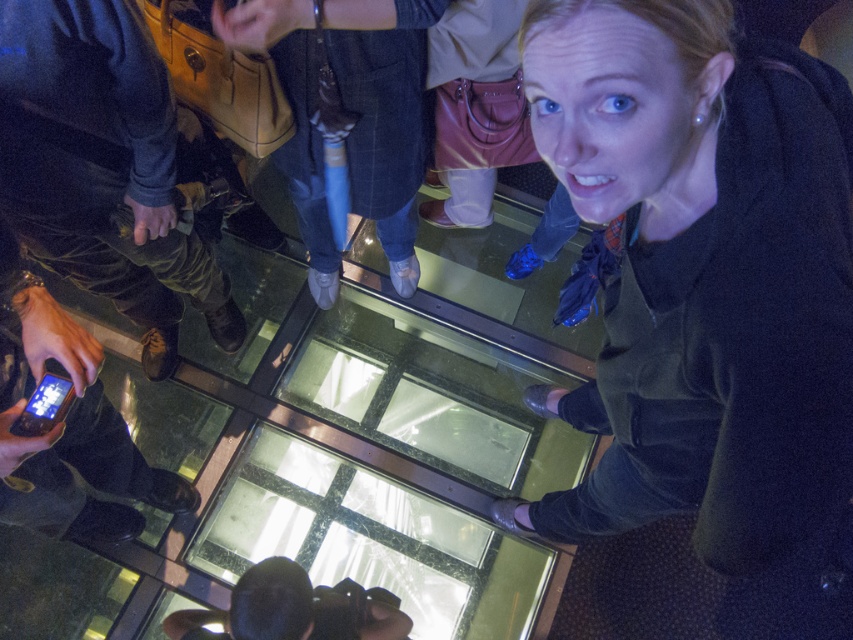
Based on the photo, is velvet black sweater at upper right behind camouflage pants at left?

No, it is in front of camouflage pants at left.

Looking at this image, can you confirm if velvet black sweater at upper right is positioned below camouflage pants at left?

Correct, velvet black sweater at upper right is located below camouflage pants at left.

Is point (709, 492) positioned behind point (149, 232)?

No, (709, 492) is in front of (149, 232).

This screenshot has width=853, height=640. What are the coordinates of `velvet black sweater at upper right` in the screenshot? It's located at (705, 284).